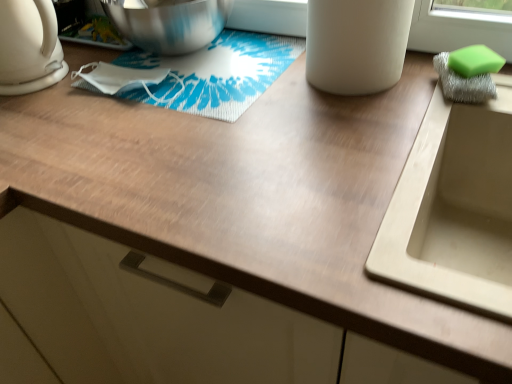
The image size is (512, 384). I want to click on free spot in front of shiny metallic mixing bowl at upper left, so click(132, 113).